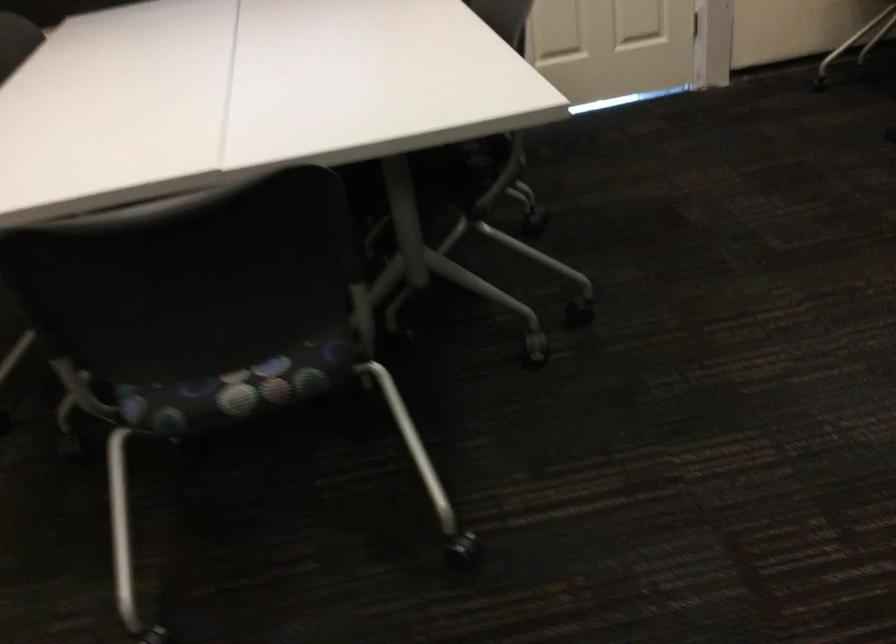
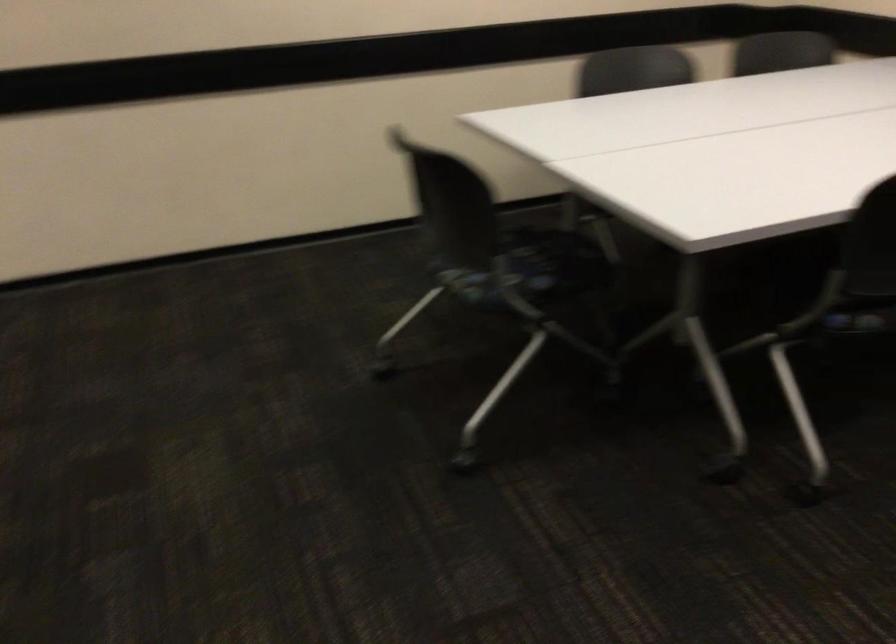
Where in the second image is the point corresponding to point 273,361 from the first image?

(494, 285)